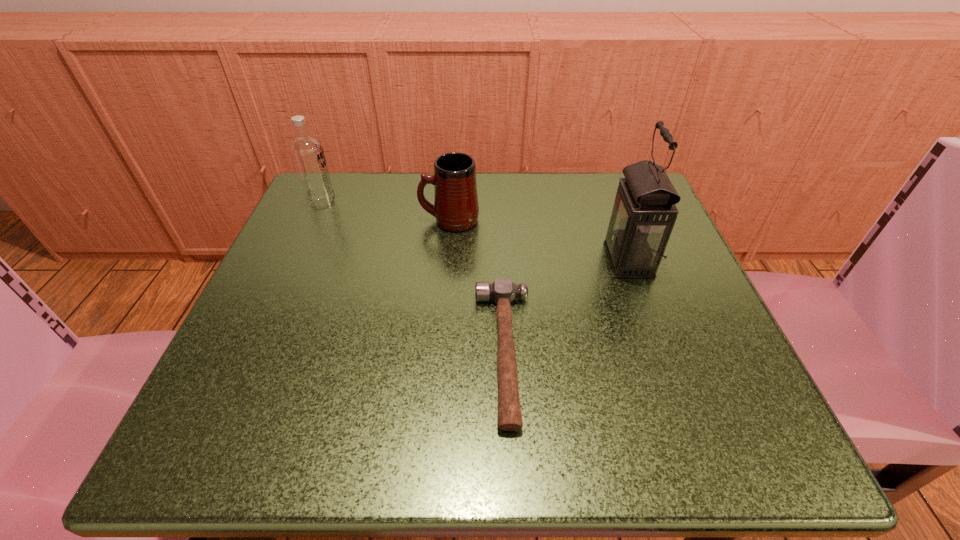
Identify the location of object present at the left edge. The image size is (960, 540). (307, 152).

This screenshot has height=540, width=960. I want to click on object present at the right edge, so click(x=644, y=213).

Identify the location of object situated at the far left corner. (307, 152).

You are a GUI agent. You are given a task and a screenshot of the screen. Output one action in this format:
    pyautogui.click(x=<x>, y=<y>)
    Task: Click on the free location at the far edge
    The width and height of the screenshot is (960, 540).
    Given the screenshot: What is the action you would take?
    pyautogui.click(x=408, y=187)

Where is `vacant space at the near edge of the desktop`? The width and height of the screenshot is (960, 540). vacant space at the near edge of the desktop is located at coordinates (336, 415).

At what (x,y) coordinates should I click in order to perform the action: click on vacant space at the left edge of the desktop. Please return your answer as a coordinate pair (x, y). The image size is (960, 540). Looking at the image, I should click on (323, 299).

You are a GUI agent. You are given a task and a screenshot of the screen. Output one action in this format:
    pyautogui.click(x=<x>, y=<y>)
    Task: Click on the free region at the right edge of the desktop
    
    Given the screenshot: What is the action you would take?
    [668, 334]

The height and width of the screenshot is (540, 960). Find the location of `free region at the far left corner of the desktop`. free region at the far left corner of the desktop is located at coordinates 348,199.

The image size is (960, 540). I want to click on vacant region at the far right corner of the desktop, so click(587, 180).

Identify the location of vacant point located between the vodka and the third tallest object. The height and width of the screenshot is (540, 960). (386, 212).